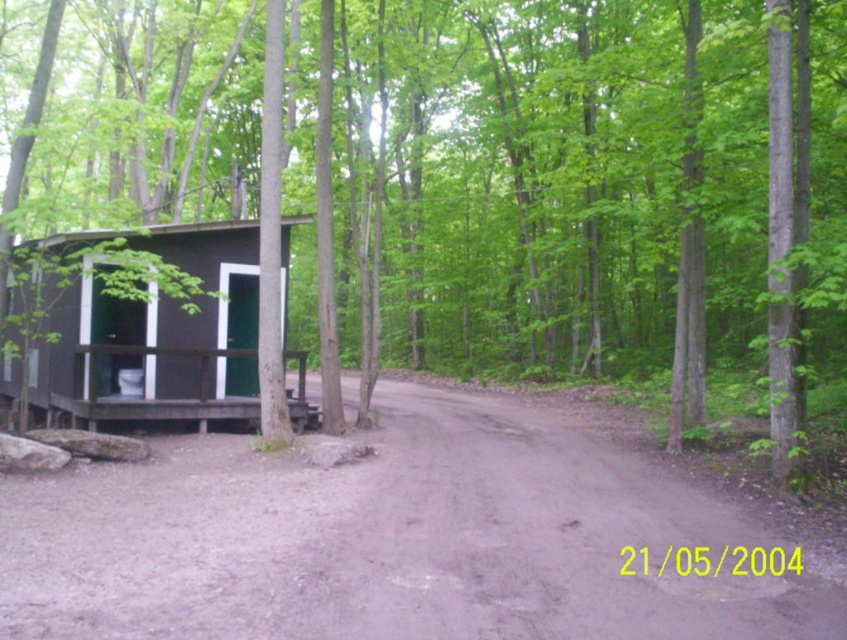
Which is in front, point (628, 506) or point (212, 413)?

Point (628, 506) is more forward.

Does brown dirt track at center come in front of black wood cabin at left?

Yes, brown dirt track at center is closer to the viewer.

Which is behind, point (721, 580) or point (126, 352)?

The point (126, 352) is behind.

You are a GUI agent. You are given a task and a screenshot of the screen. Output one action in this format:
    pyautogui.click(x=<x>, y=<y>)
    Task: Click on the brown dirt track at center
    The height and width of the screenshot is (640, 847).
    Given the screenshot: What is the action you would take?
    pyautogui.click(x=388, y=541)